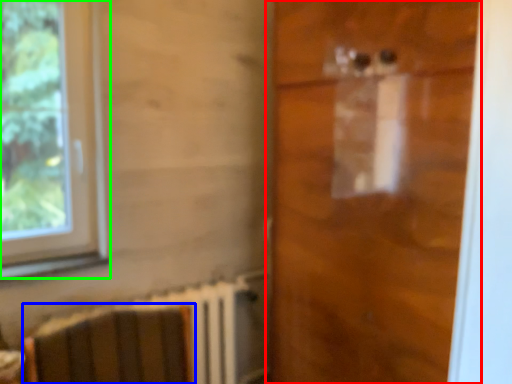
Question: Based on their relative distances, which object is nearer to door (highlighted by a red box)? Choose from armchair (highlighted by a blue box) and window (highlighted by a green box).

Choices:
 (A) armchair
 (B) window

Answer: (A)